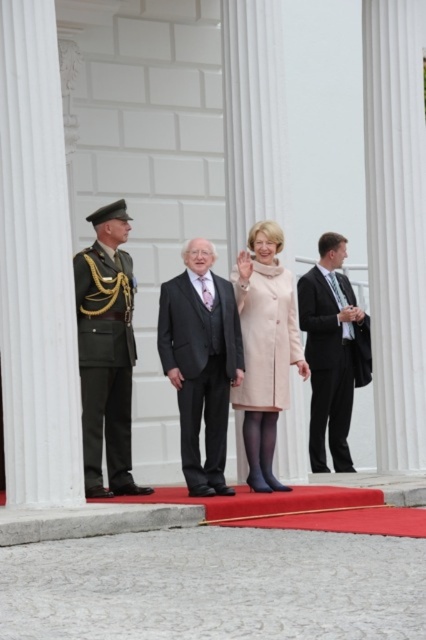
The image size is (426, 640). Describe the element at coordinates (106, 352) in the screenshot. I see `green military uniform at left` at that location.

Which of these two, green military uniform at left or pale pink wool coat at center, stands shorter?

Standing shorter between the two is pale pink wool coat at center.

Is point (118, 227) farther from viewer compared to point (273, 365)?

That is True.

What are the coordinates of `green military uniform at left` in the screenshot? It's located at (106, 352).

Between point (226, 305) and point (339, 324), which one is positioned behind?

The point (339, 324) is behind.

Who is lower down, dark gray suit at center or black suit at right?

dark gray suit at center is below.

Describe the element at coordinates (201, 362) in the screenshot. I see `dark gray suit at center` at that location.

Identify the location of dark gray suit at center. (201, 362).

Based on the photo, can you confirm if dark gray suit at center is positioned to the right of pale pink wool coat at center?

Incorrect, dark gray suit at center is not on the right side of pale pink wool coat at center.

Is dark gray suit at center taller than pale pink wool coat at center?

No.

What do you see at coordinates (201, 362) in the screenshot? I see `dark gray suit at center` at bounding box center [201, 362].

The width and height of the screenshot is (426, 640). What are the coordinates of `dark gray suit at center` in the screenshot? It's located at (201, 362).